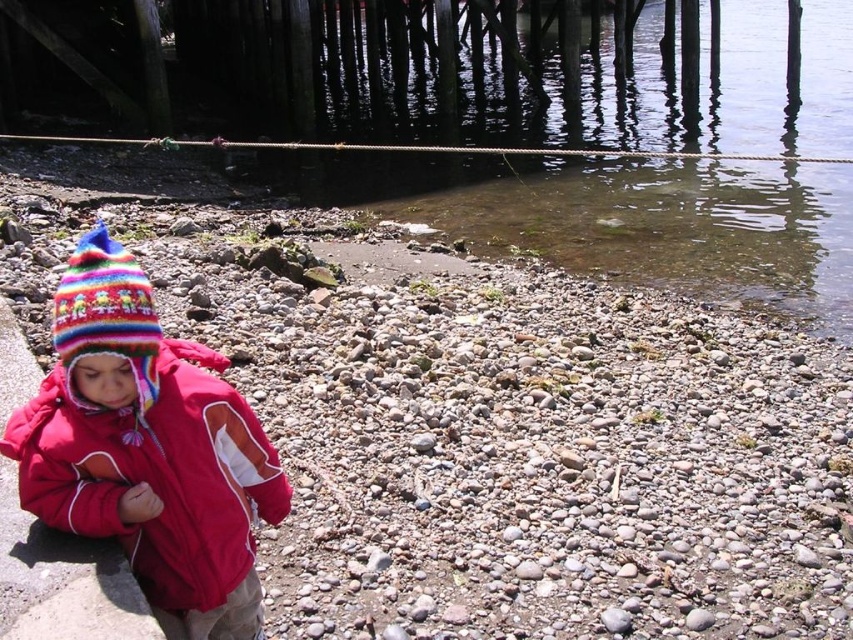
Does point (587, 168) come behind point (71, 394)?

Yes, it is behind point (71, 394).

Is clear water at lower center shorter than multicolored knitted hat at left?

No, clear water at lower center is not shorter than multicolored knitted hat at left.

At what (x,y) coordinates should I click in order to perform the action: click on clear water at lower center. Please return your answer as a coordinate pair (x, y). The width and height of the screenshot is (853, 640). Looking at the image, I should click on (639, 220).

This screenshot has width=853, height=640. What do you see at coordinates (148, 449) in the screenshot?
I see `knitted woolen hat at lower left` at bounding box center [148, 449].

Is knitted woolen hat at lower left closer to the viewer compared to red fabric curb at lower left?

Yes, knitted woolen hat at lower left is in front of red fabric curb at lower left.

At what (x,y) coordinates should I click in order to perform the action: click on knitted woolen hat at lower left. Please return your answer as a coordinate pair (x, y). This screenshot has height=640, width=853. Looking at the image, I should click on (148, 449).

Is point (88, 561) positioned in front of point (143, 356)?

No, (88, 561) is further to viewer.

You are a GUI agent. You are given a task and a screenshot of the screen. Output one action in this format:
    pyautogui.click(x=<x>, y=<y>)
    Task: Click on the red fabric curb at lower left
    
    Given the screenshot: What is the action you would take?
    pyautogui.click(x=62, y=580)

I want to click on red fabric curb at lower left, so click(x=62, y=580).